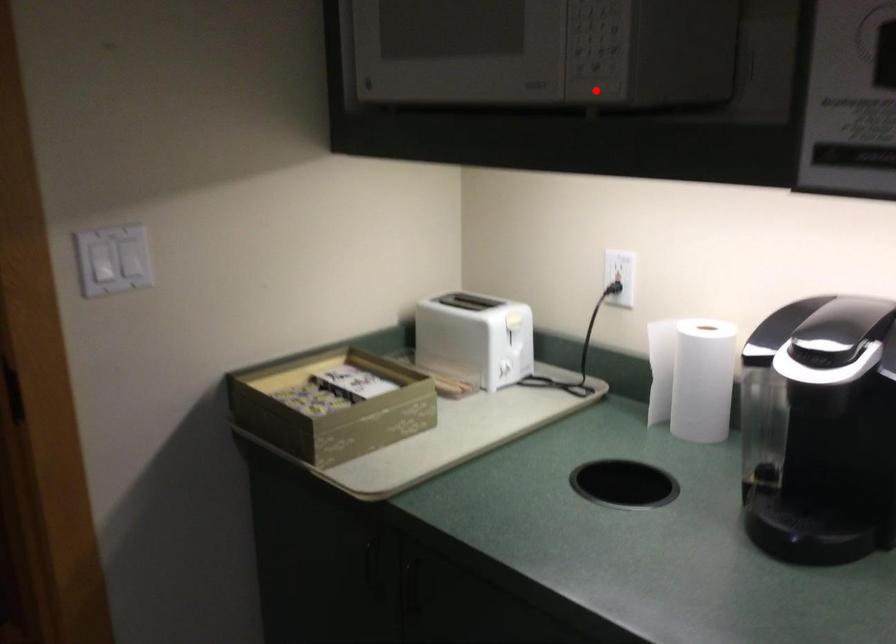
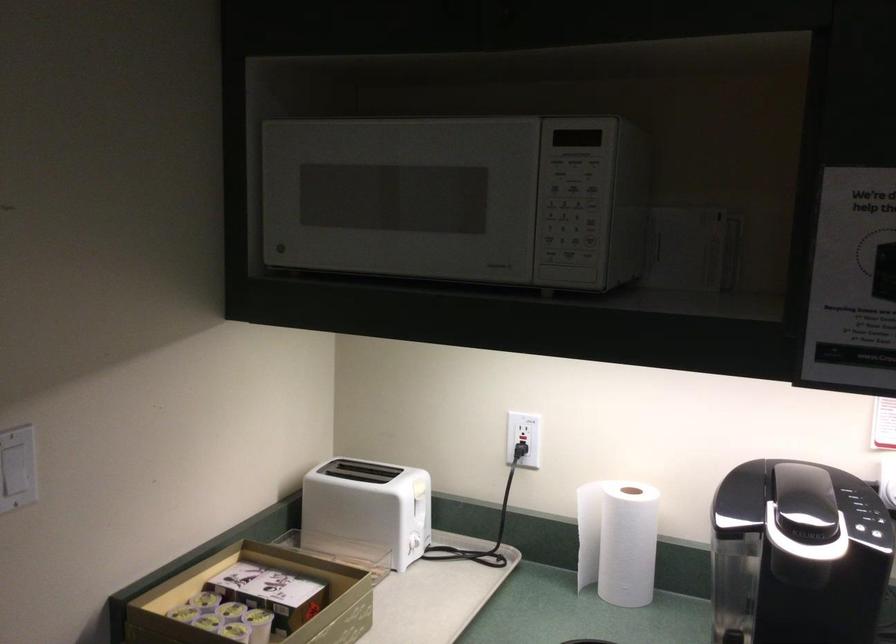
Question: I am providing you with two images of the same scene from different viewpoints. A red point is marked on the first image. Can you still see the location of the red point in image 2?

Choices:
 (A) Yes
 (B) No

Answer: (A)